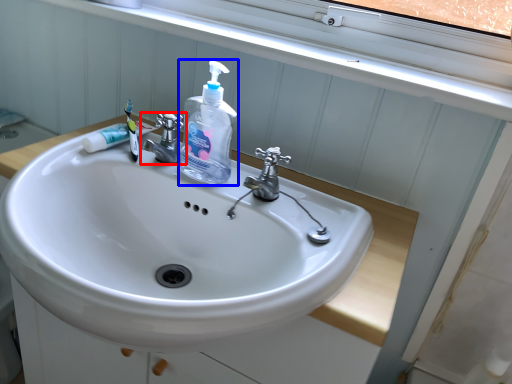
Question: Which object appears closest to the camera in this image, tap (highlighted by a red box) or cleaning product (highlighted by a blue box)?

Choices:
 (A) tap
 (B) cleaning product

Answer: (B)